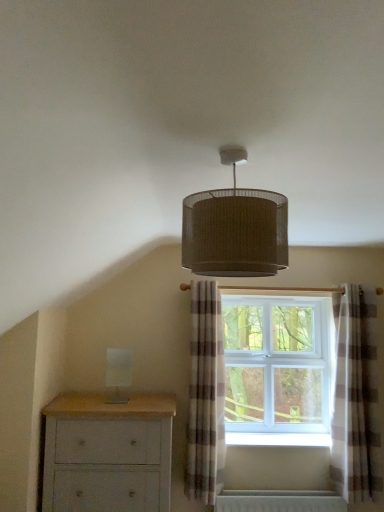
Question: Considering the positions of white plastic window at center and light gray painted wood chest of drawers at lower left in the image, is white plastic window at center wider or thinner than light gray painted wood chest of drawers at lower left?

Choices:
 (A) thin
 (B) wide

Answer: (A)

Question: Is white plastic window at center situated inside light gray painted wood chest of drawers at lower left or outside?

Choices:
 (A) outside
 (B) inside

Answer: (A)

Question: Considering the real-world distances, which object is farthest from the light gray painted wood chest of drawers at lower left?

Choices:
 (A) plaid fabric curtain at center, which ranks as the first curtain in left-to-right order
 (B) matte brown lampshade at upper center
 (C) matte brown fabric lampshade at center
 (D) white painted wood at lower center
 (E) plaid fabric curtain at center, positioned as the second curtain in left-to-right order

Answer: (C)

Question: Considering the real-world distances, which object is farthest from the white painted wood at lower center?

Choices:
 (A) plaid fabric curtain at center, the 2th curtain from the right
 (B) light gray painted wood chest of drawers at lower left
 (C) plaid fabric curtain at center, positioned as the second curtain in left-to-right order
 (D) white plastic window at center
 (E) matte brown fabric lampshade at center

Answer: (E)